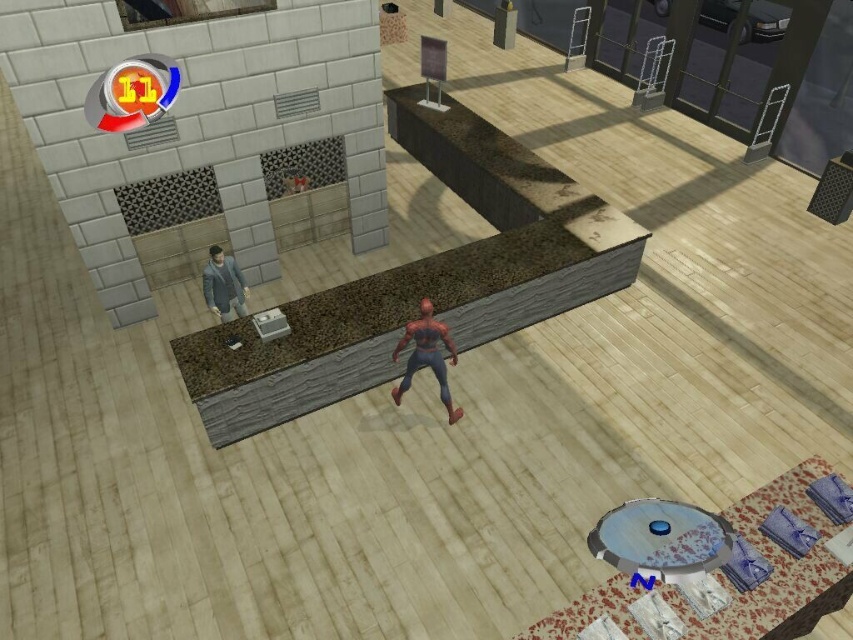
Question: Among these objects, which one is nearest to the camera?

Choices:
 (A) shiny spandex suit at center
 (B) smooth gray suit at left

Answer: (A)

Question: From the image, what is the correct spatial relationship of shiny spandex suit at center in relation to smooth gray suit at left?

Choices:
 (A) left
 (B) right

Answer: (B)

Question: Observing the image, what is the correct spatial positioning of shiny spandex suit at center in reference to smooth gray suit at left?

Choices:
 (A) above
 (B) below

Answer: (B)

Question: Is shiny spandex suit at center positioned in front of smooth gray suit at left?

Choices:
 (A) yes
 (B) no

Answer: (A)

Question: Which object is closer to the camera taking this photo?

Choices:
 (A) smooth gray suit at left
 (B) shiny spandex suit at center

Answer: (B)